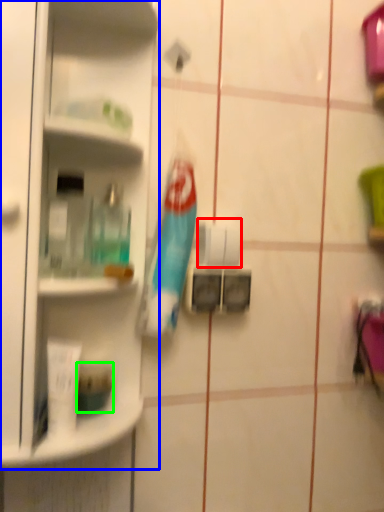
Question: Based on their relative distances, which object is nearer to toilet paper (highlighted by a red box)? Choose from shelf (highlighted by a blue box) and toiletry (highlighted by a green box).

Choices:
 (A) shelf
 (B) toiletry

Answer: (A)